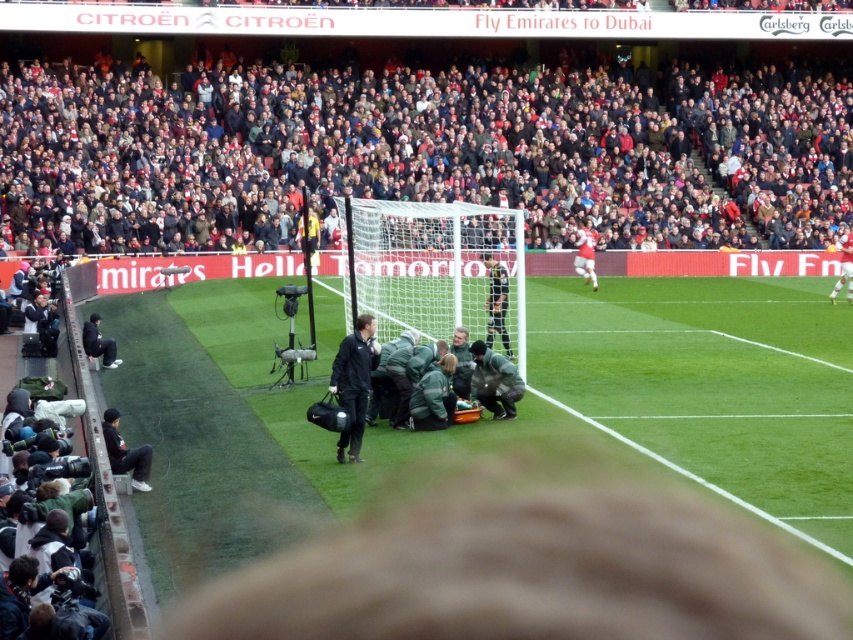
Consider the image. You are a photographer at the football stadium. You notice the dark gray crowd at upper center and the black matte jacket at center in your viewfinder. Which object is positioned to the right side of the other?

The dark gray crowd at upper center is to the right of the black matte jacket at center.